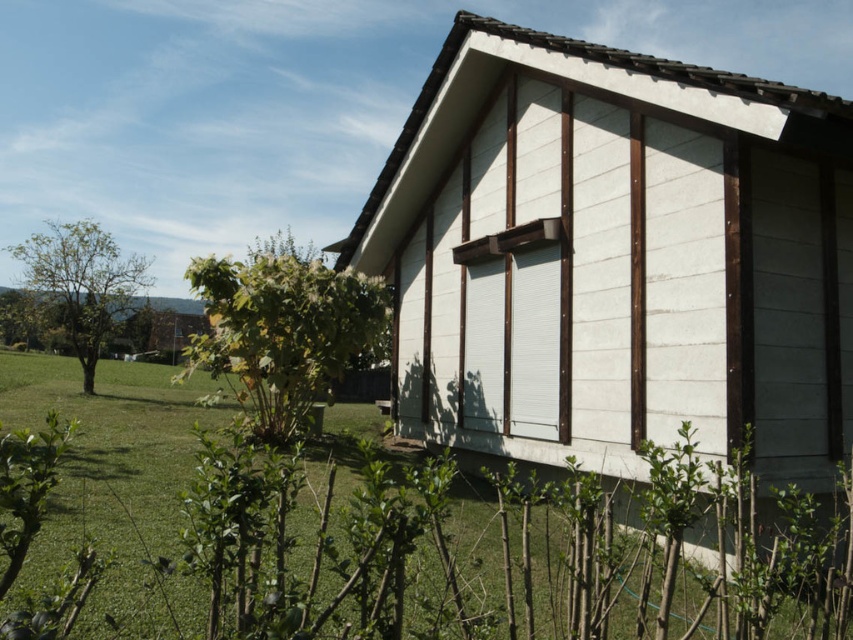
Question: Which of these objects is positioned closest to the green leafy tree at left?

Choices:
 (A) green leafy tree at center
 (B) green grass at lower left
 (C) white matte window at center

Answer: (A)

Question: Does green leafy tree at center have a smaller size compared to white matte window at center?

Choices:
 (A) no
 (B) yes

Answer: (A)

Question: Can you confirm if green leafy tree at center is smaller than white matte window at center?

Choices:
 (A) yes
 (B) no

Answer: (B)

Question: Which of the following is the closest to the observer?

Choices:
 (A) (97, 312)
 (B) (254, 413)
 (C) (693, 296)
 (D) (398, 481)

Answer: (C)

Question: Does white wood hut at center appear under white matte window at center?

Choices:
 (A) yes
 (B) no

Answer: (B)

Question: Which of the following is the closest to the observer?

Choices:
 (A) green leafy tree at left
 (B) white matte window at center
 (C) green leafy tree at center

Answer: (B)